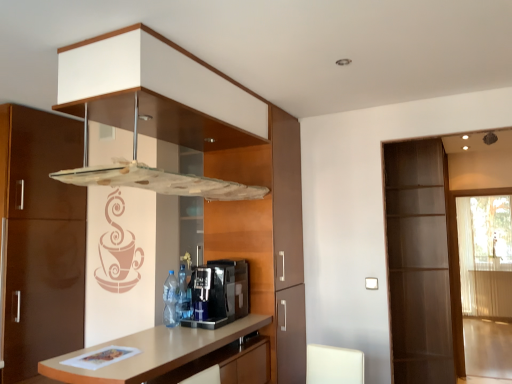
Question: Is black plastic coffee machine at center oriented away from light brown wood countertop at center?

Choices:
 (A) yes
 (B) no

Answer: (B)

Question: Does black plastic coffee machine at center lie in front of light brown wood countertop at center?

Choices:
 (A) no
 (B) yes

Answer: (A)

Question: Does black plastic coffee machine at center have a greater width compared to light brown wood countertop at center?

Choices:
 (A) yes
 (B) no

Answer: (B)

Question: Considering the relative sizes of black plastic coffee machine at center and light brown wood countertop at center in the image provided, is black plastic coffee machine at center smaller than light brown wood countertop at center?

Choices:
 (A) yes
 (B) no

Answer: (A)

Question: From the image's perspective, is black plastic coffee machine at center above light brown wood countertop at center?

Choices:
 (A) no
 (B) yes

Answer: (B)

Question: Is black plastic coffee machine at center positioned far away from light brown wood countertop at center?

Choices:
 (A) no
 (B) yes

Answer: (A)

Question: Is black plastic coffee machine at center wider than transparent glass screen door at right, marked as the 2th screen door in a right-to-left arrangement?

Choices:
 (A) no
 (B) yes

Answer: (A)

Question: From a real-world perspective, is black plastic coffee machine at center beneath transparent glass screen door at right, marked as the 2th screen door in a right-to-left arrangement?

Choices:
 (A) yes
 (B) no

Answer: (B)

Question: Is black plastic coffee machine at center at the right side of transparent glass screen door at right, which ranks as the 1th screen door in left-to-right order?

Choices:
 (A) no
 (B) yes

Answer: (A)

Question: Is black plastic coffee machine at center smaller than transparent glass screen door at right, marked as the 2th screen door in a right-to-left arrangement?

Choices:
 (A) no
 (B) yes

Answer: (B)

Question: Can you confirm if black plastic coffee machine at center is thinner than transparent glass screen door at right, which ranks as the 1th screen door in left-to-right order?

Choices:
 (A) yes
 (B) no

Answer: (A)

Question: From the image's perspective, is black plastic coffee machine at center below transparent glass screen door at right, marked as the 2th screen door in a right-to-left arrangement?

Choices:
 (A) no
 (B) yes

Answer: (A)

Question: Considering the relative positions of blue plastic bottle at center, the first bottle from the front, and black plastic coffee machine at center in the image provided, is blue plastic bottle at center, the first bottle from the front, behind black plastic coffee machine at center?

Choices:
 (A) yes
 (B) no

Answer: (A)